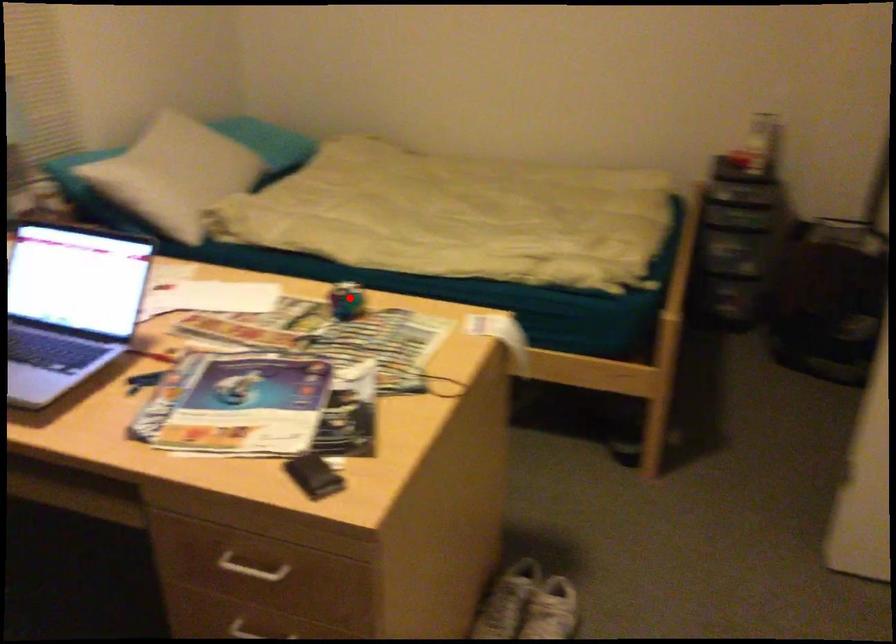
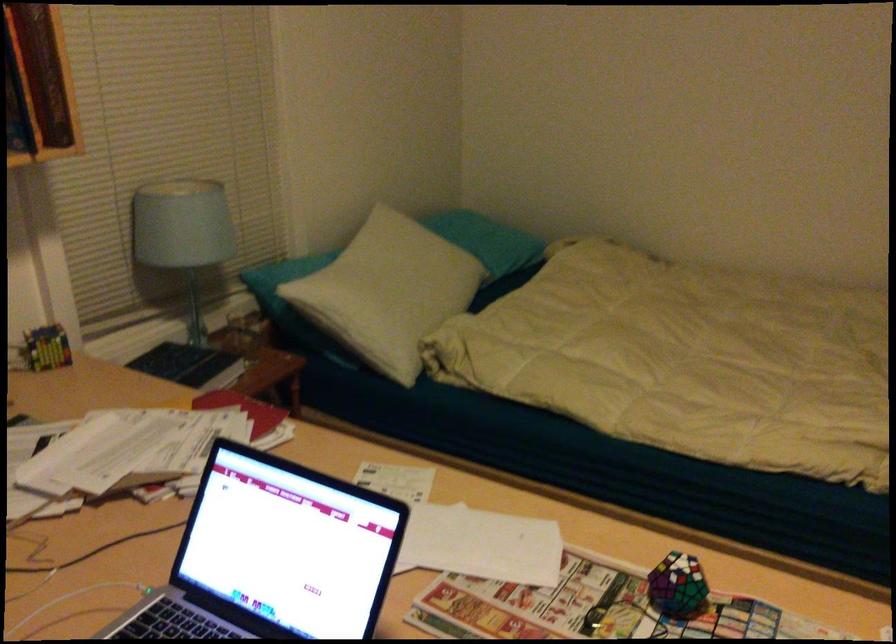
Where in the second image is the point corresponding to the highlighted location from the first image?

(677, 585)